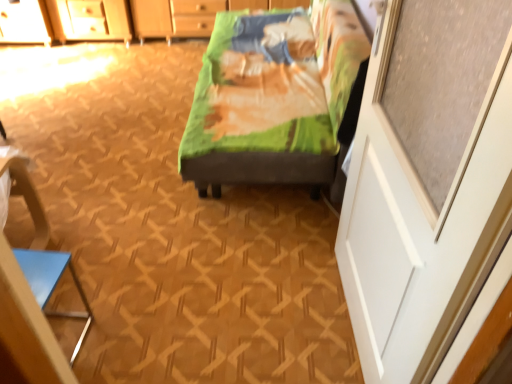
Question: Is blue glossy triangle at lower left not near white matte screen door at right?

Choices:
 (A) yes
 (B) no

Answer: (A)

Question: Considering the relative sizes of blue glossy triangle at lower left and white matte screen door at right in the image provided, is blue glossy triangle at lower left thinner than white matte screen door at right?

Choices:
 (A) no
 (B) yes

Answer: (A)

Question: Is blue glossy triangle at lower left closer to the viewer compared to white matte screen door at right?

Choices:
 (A) yes
 (B) no

Answer: (B)

Question: Considering the relative positions of blue glossy triangle at lower left and white matte screen door at right in the image provided, is blue glossy triangle at lower left to the left of white matte screen door at right from the viewer's perspective?

Choices:
 (A) no
 (B) yes

Answer: (B)

Question: Is blue glossy triangle at lower left facing away from white matte screen door at right?

Choices:
 (A) no
 (B) yes

Answer: (A)

Question: Looking at their shapes, would you say white matte screen door at right is wider or thinner than green fabric bed at center?

Choices:
 (A) wide
 (B) thin

Answer: (B)

Question: From a real-world perspective, is white matte screen door at right physically located above or below green fabric bed at center?

Choices:
 (A) above
 (B) below

Answer: (A)

Question: Based on their sizes in the image, would you say white matte screen door at right is bigger or smaller than green fabric bed at center?

Choices:
 (A) small
 (B) big

Answer: (A)

Question: From the image's perspective, is white matte screen door at right above or below green fabric bed at center?

Choices:
 (A) below
 (B) above

Answer: (A)

Question: Is green fabric bed at center in front of or behind white matte screen door at right in the image?

Choices:
 (A) front
 (B) behind

Answer: (B)

Question: Is green fabric bed at center situated inside white matte screen door at right or outside?

Choices:
 (A) outside
 (B) inside

Answer: (A)

Question: Considering the positions of green fabric bed at center and white matte screen door at right in the image, is green fabric bed at center wider or thinner than white matte screen door at right?

Choices:
 (A) wide
 (B) thin

Answer: (A)

Question: From a real-world perspective, is green fabric bed at center positioned above or below white matte screen door at right?

Choices:
 (A) below
 (B) above

Answer: (A)

Question: From the image's perspective, is white matte screen door at right positioned above or below blue glossy triangle at lower left?

Choices:
 (A) below
 (B) above

Answer: (B)

Question: Is point (349, 246) closer or farther from the camera than point (6, 163)?

Choices:
 (A) farther
 (B) closer

Answer: (A)